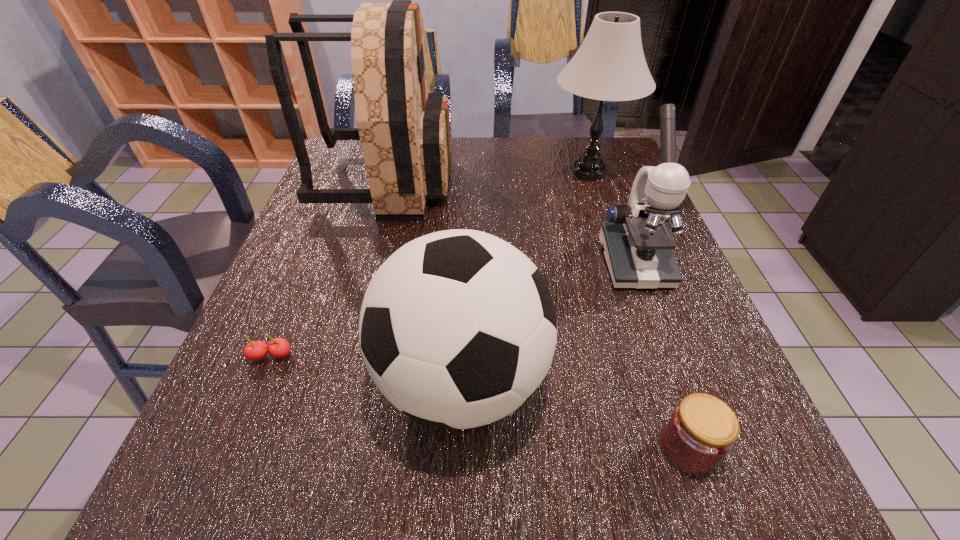
Locate an element on the screen. The image size is (960, 540). jam present at the right edge is located at coordinates (701, 431).

Where is `object situated at the far left corner`? The width and height of the screenshot is (960, 540). object situated at the far left corner is located at coordinates (404, 130).

Where is `object located at the far right corner`? object located at the far right corner is located at coordinates (610, 65).

Where is `object located at the near right corner`? object located at the near right corner is located at coordinates (701, 431).

In the image, there is a desktop. Where is `vacant space at the far edge`? vacant space at the far edge is located at coordinates (547, 148).

In the image, there is a desktop. At what (x,y) coordinates should I click in order to perform the action: click on free space at the left edge. Please return your answer as a coordinate pair (x, y). Image resolution: width=960 pixels, height=540 pixels. Looking at the image, I should click on (358, 235).

This screenshot has height=540, width=960. In the image, there is a desktop. Find the location of `vacant space at the right edge`. vacant space at the right edge is located at coordinates (654, 329).

In order to click on free spot at the far left corner of the desktop in this screenshot , I will do coord(333,173).

This screenshot has height=540, width=960. What are the coordinates of `free space between the soccer ball and the shortest object` in the screenshot? It's located at (367, 368).

Find the location of `empty location between the cherry and the soccer ball`. empty location between the cherry and the soccer ball is located at coordinates (367, 368).